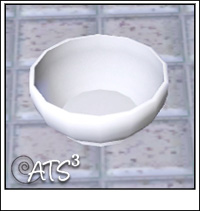
Identify the location of tile. (173, 157).